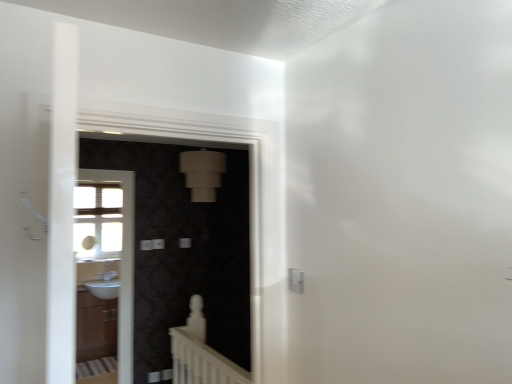
How much space does matte black screen door at center, placed as the first screen door when sorted from right to left, occupy vertically?

The height of matte black screen door at center, placed as the first screen door when sorted from right to left, is 3.62 feet.

Describe the element at coordinates (95, 326) in the screenshot. This screenshot has width=512, height=384. I see `matte brown cabinet at lower left` at that location.

Where is `white matte balustrade at lower center`? white matte balustrade at lower center is located at coordinates (201, 360).

Describe the element at coordinates (104, 285) in the screenshot. The image size is (512, 384). I see `white glossy sink at lower left` at that location.

The height and width of the screenshot is (384, 512). I want to click on white glossy sink at left, placed as the 2th screen door when sorted from right to left, so click(x=122, y=266).

Is white glossy sink at left, marked as the first screen door in a left-to-right arrangement, wider than white matte balustrade at lower center?

Incorrect, the width of white glossy sink at left, marked as the first screen door in a left-to-right arrangement, does not surpass that of white matte balustrade at lower center.

Is white glossy sink at left, acting as the 1th screen door starting from the back, located outside white matte balustrade at lower center?

Absolutely, white glossy sink at left, acting as the 1th screen door starting from the back, is external to white matte balustrade at lower center.

Considering the relative sizes of white glossy sink at left, marked as the first screen door in a left-to-right arrangement, and white matte balustrade at lower center in the image provided, is white glossy sink at left, marked as the first screen door in a left-to-right arrangement, taller than white matte balustrade at lower center?

Yes, white glossy sink at left, marked as the first screen door in a left-to-right arrangement, is taller than white matte balustrade at lower center.

From a real-world perspective, is white glossy sink at left, arranged as the 2th screen door when viewed from the front, physically located above or below white matte balustrade at lower center?

white glossy sink at left, arranged as the 2th screen door when viewed from the front, is above white matte balustrade at lower center.

From a real-world perspective, is white glossy sink at lower left physically located above or below matte black screen door at center, the 1th screen door viewed from the front?

white glossy sink at lower left is below matte black screen door at center, the 1th screen door viewed from the front.

Could you tell me if white glossy sink at lower left is facing matte black screen door at center, placed as the first screen door when sorted from right to left?

Yes, white glossy sink at lower left faces towards matte black screen door at center, placed as the first screen door when sorted from right to left.

How far apart are white glossy sink at lower left and matte black screen door at center, the 1th screen door viewed from the front?

31.51 inches.

Do you think white glossy sink at lower left is within matte black screen door at center, the 1th screen door viewed from the front, or outside of it?

white glossy sink at lower left lies outside matte black screen door at center, the 1th screen door viewed from the front.

From the picture: Measure the distance between white matte balustrade at lower center and white glossy sink at left, placed as the 2th screen door when sorted from right to left.

white matte balustrade at lower center is 3.83 feet from white glossy sink at left, placed as the 2th screen door when sorted from right to left.

Is white matte balustrade at lower center further to the viewer compared to white glossy sink at left, acting as the 1th screen door starting from the back?

No, white matte balustrade at lower center is in front of white glossy sink at left, acting as the 1th screen door starting from the back.

Which is more to the right, white matte balustrade at lower center or white glossy sink at left, placed as the 2th screen door when sorted from right to left?

Positioned to the right is white matte balustrade at lower center.

From a real-world perspective, is white matte balustrade at lower center physically located above or below white glossy sink at left, arranged as the 2th screen door when viewed from the front?

Clearly, from a real-world perspective, white matte balustrade at lower center is below white glossy sink at left, arranged as the 2th screen door when viewed from the front.

In the scene shown: From a real-world perspective, does matte brown cabinet at lower left stand above white glossy sink at left, placed as the 2th screen door when sorted from right to left?

Incorrect, from a real-world perspective, matte brown cabinet at lower left is lower than white glossy sink at left, placed as the 2th screen door when sorted from right to left.

How far apart are matte brown cabinet at lower left and white glossy sink at left, arranged as the 2th screen door when viewed from the front?

matte brown cabinet at lower left and white glossy sink at left, arranged as the 2th screen door when viewed from the front, are 12.73 inches apart.

Could you tell me if matte brown cabinet at lower left is turned towards white glossy sink at left, acting as the 1th screen door starting from the back?

Yes, matte brown cabinet at lower left is aimed at white glossy sink at left, acting as the 1th screen door starting from the back.

Considering the relative sizes of matte brown cabinet at lower left and white glossy sink at left, marked as the first screen door in a left-to-right arrangement, in the image provided, is matte brown cabinet at lower left shorter than white glossy sink at left, marked as the first screen door in a left-to-right arrangement,?

Yes.

From the image's perspective, is matte brown cabinet at lower left over white glossy sink at lower left?

Actually, matte brown cabinet at lower left appears below white glossy sink at lower left in the image.

Are matte brown cabinet at lower left and white glossy sink at lower left located far from each other?

matte brown cabinet at lower left is actually quite close to white glossy sink at lower left.

Is point (79, 360) closer to viewer compared to point (106, 286)?

That is True.

From the picture: Is matte black screen door at center, the 2th screen door from the left, wider than white glossy sink at left, acting as the 1th screen door starting from the back?

Yes, matte black screen door at center, the 2th screen door from the left, is wider than white glossy sink at left, acting as the 1th screen door starting from the back.

Would you consider matte black screen door at center, the 2th screen door positioned from the back, to be distant from white glossy sink at left, marked as the first screen door in a left-to-right arrangement?

No, matte black screen door at center, the 2th screen door positioned from the back, is in close proximity to white glossy sink at left, marked as the first screen door in a left-to-right arrangement.

Can you tell me how much matte black screen door at center, the 1th screen door viewed from the front, and white glossy sink at left, arranged as the 2th screen door when viewed from the front, differ in facing direction?

The angle between the facing direction of matte black screen door at center, the 1th screen door viewed from the front, and the facing direction of white glossy sink at left, arranged as the 2th screen door when viewed from the front, is 0.000534 degrees.

Which is in front, point (228, 239) or point (126, 279)?

The point (126, 279) is closer.

Considering the relative sizes of matte brown cabinet at lower left and white matte balustrade at lower center in the image provided, is matte brown cabinet at lower left smaller than white matte balustrade at lower center?

No, matte brown cabinet at lower left is not smaller than white matte balustrade at lower center.

Does matte brown cabinet at lower left have a greater width compared to white matte balustrade at lower center?

Yes, matte brown cabinet at lower left is wider than white matte balustrade at lower center.

From a real-world perspective, which is physically below, matte brown cabinet at lower left or white matte balustrade at lower center?

From a 3D spatial view, matte brown cabinet at lower left is below.

Is matte brown cabinet at lower left in front of or behind white matte balustrade at lower center in the image?

In the image, matte brown cabinet at lower left appears behind white matte balustrade at lower center.

Locate an element on the screen. the 1st screen door above the white matte balustrade at lower center (from a real-world perspective) is located at coordinates (122, 266).

Where is `sink behind the matte black screen door at center, the 2th screen door positioned from the back`? The height and width of the screenshot is (384, 512). sink behind the matte black screen door at center, the 2th screen door positioned from the back is located at coordinates (104, 285).

Considering their positions, is white glossy sink at left, marked as the first screen door in a left-to-right arrangement, positioned further to white matte balustrade at lower center than white glossy sink at lower left?

The object further to white matte balustrade at lower center is white glossy sink at lower left.

Based on their spatial positions, is white glossy sink at left, acting as the 1th screen door starting from the back, or matte black screen door at center, placed as the first screen door when sorted from right to left, further from white matte balustrade at lower center?

matte black screen door at center, placed as the first screen door when sorted from right to left, lies further to white matte balustrade at lower center than the other object.

Looking at the image, which one is located further to white glossy sink at lower left, matte brown cabinet at lower left or white matte balustrade at lower center?

Based on the image, white matte balustrade at lower center appears to be further to white glossy sink at lower left.

Based on their spatial positions, is white glossy sink at left, arranged as the 2th screen door when viewed from the front, or white matte balustrade at lower center closer to white glossy sink at lower left?

white glossy sink at left, arranged as the 2th screen door when viewed from the front, is positioned closer to the anchor white glossy sink at lower left.

Estimate the real-world distances between objects in this image. Which object is further from white glossy sink at lower left, matte black screen door at center, the 2th screen door positioned from the back, or white matte balustrade at lower center?

white matte balustrade at lower center is positioned further to the anchor white glossy sink at lower left.

Based on their spatial positions, is white matte balustrade at lower center or matte black screen door at center, placed as the first screen door when sorted from right to left, closer to matte brown cabinet at lower left?

matte black screen door at center, placed as the first screen door when sorted from right to left, lies closer to matte brown cabinet at lower left than the other object.

Based on their spatial positions, is white glossy sink at lower left or matte brown cabinet at lower left further from matte black screen door at center, the 1th screen door viewed from the front?

white glossy sink at lower left is positioned further to the anchor matte black screen door at center, the 1th screen door viewed from the front.

Which object lies further to the anchor point white glossy sink at left, marked as the first screen door in a left-to-right arrangement, white matte balustrade at lower center or matte brown cabinet at lower left?

white matte balustrade at lower center is further to white glossy sink at left, marked as the first screen door in a left-to-right arrangement.

This screenshot has width=512, height=384. Identify the location of cabinetry between matte black screen door at center, the 1th screen door viewed from the front, and white glossy sink at lower left, along the z-axis. (95, 326).

This screenshot has height=384, width=512. In order to click on cabinetry between white glossy sink at left, placed as the 2th screen door when sorted from right to left, and white glossy sink at lower left in the front-back direction in this screenshot , I will do `click(95, 326)`.

At what (x,y) coordinates should I click in order to perform the action: click on balustrade between matte black screen door at center, the 1th screen door viewed from the front, and white glossy sink at lower left, along the z-axis. Please return your answer as a coordinate pair (x, y). The height and width of the screenshot is (384, 512). Looking at the image, I should click on click(201, 360).

Image resolution: width=512 pixels, height=384 pixels. I want to click on balustrade between matte black screen door at center, the 2th screen door from the left, and matte brown cabinet at lower left from front to back, so click(x=201, y=360).